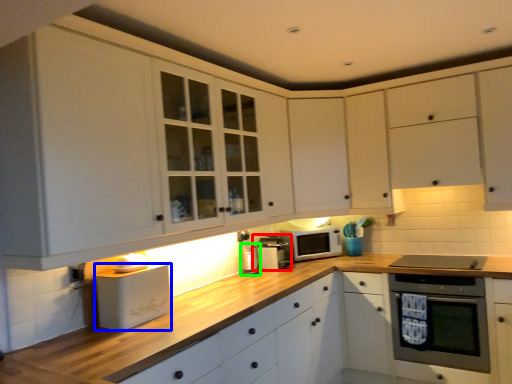
Question: Which is farther away from appliance (highlighted by a red box)? appliance (highlighted by a blue box) or appliance (highlighted by a green box)?

Choices:
 (A) appliance
 (B) appliance

Answer: (A)